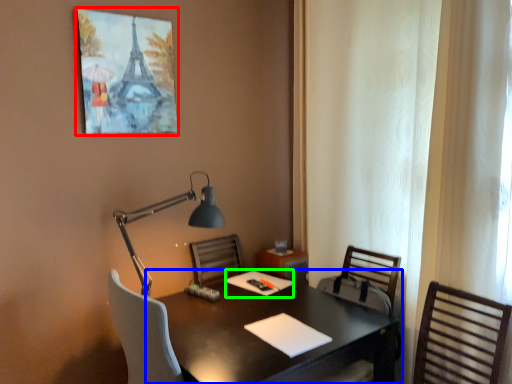
Question: Considering the real-world distances, which object is closest to picture frame (highlighted by a red box)? desk (highlighted by a blue box) or notepad (highlighted by a green box).

Choices:
 (A) desk
 (B) notepad

Answer: (A)